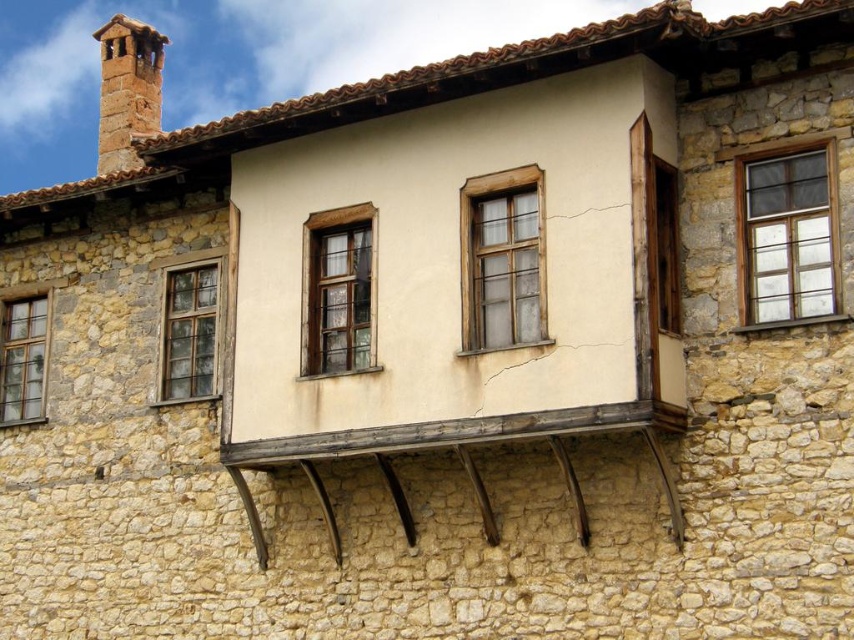
You are standing in front of the house and notice two windows. The wooden window at center and the translucent glass window at left. Which window is positioned more to the left side of the house?

The translucent glass window at left is positioned more to the left side of the house compared to the wooden window at center.